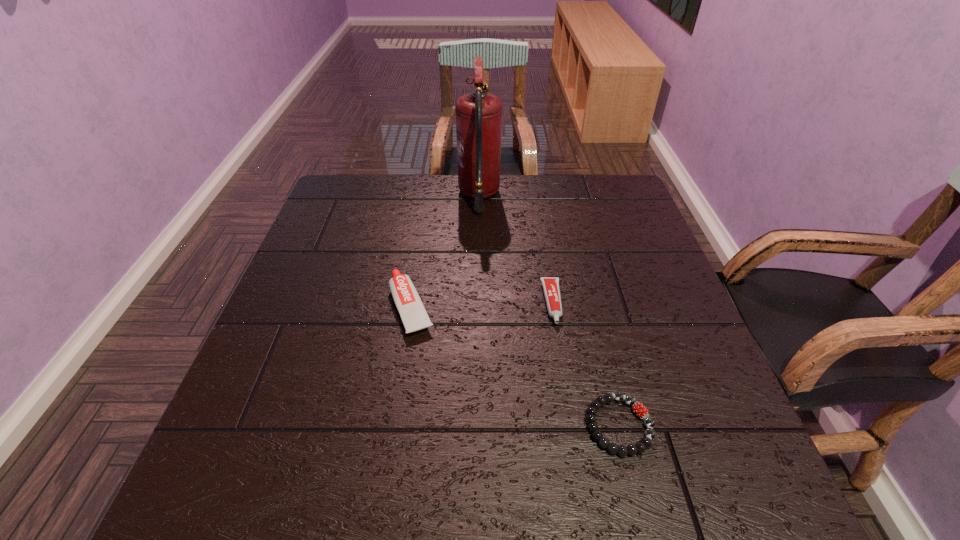
Locate an element on the screen. This screenshot has height=540, width=960. the farthest object is located at coordinates (478, 114).

This screenshot has height=540, width=960. I want to click on the tallest object, so click(478, 114).

Where is `the taller toothpaste`? the taller toothpaste is located at coordinates (411, 309).

Where is `the third shortest object`? The height and width of the screenshot is (540, 960). the third shortest object is located at coordinates (411, 309).

Image resolution: width=960 pixels, height=540 pixels. Find the location of `the right toothpaste`. the right toothpaste is located at coordinates (551, 289).

At what (x,y) coordinates should I click in order to perform the action: click on the second shortest object. Please return your answer as a coordinate pair (x, y). The height and width of the screenshot is (540, 960). Looking at the image, I should click on (551, 289).

Identify the location of bracelet. This screenshot has height=540, width=960. (640, 410).

Locate an element on the screen. the rightmost object is located at coordinates (640, 410).

The image size is (960, 540). Identify the location of vacant space situated at the front of the third object from right to left where the nozzle is aimed. (543, 195).

You are a GUI agent. You are given a task and a screenshot of the screen. Output one action in this format:
    pyautogui.click(x=<x>, y=<y>)
    Task: Click on the vacant space located on the back of the second tallest object
    The width and height of the screenshot is (960, 540).
    Given the screenshot: What is the action you would take?
    pyautogui.click(x=422, y=234)